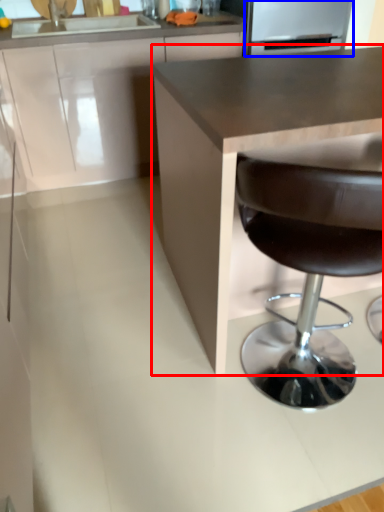
Question: Which object is further to the camera taking this photo, countertop (highlighted by a red box) or appliance (highlighted by a blue box)?

Choices:
 (A) countertop
 (B) appliance

Answer: (B)